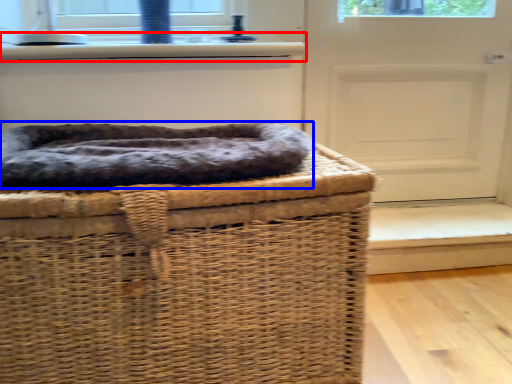
Question: Which of the following is the farthest to the observer, window sill (highlighted by a red box) or dog bed (highlighted by a blue box)?

Choices:
 (A) window sill
 (B) dog bed

Answer: (A)